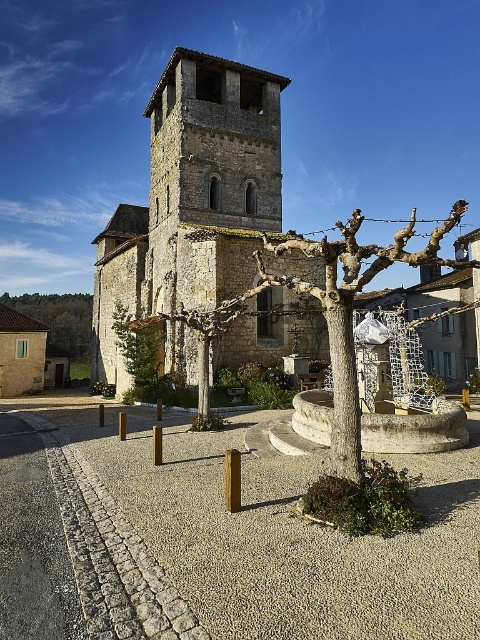
Is green leafy tree at lower left to the right of green leafy tree at center from the viewer's perspective?

Incorrect, green leafy tree at lower left is not on the right side of green leafy tree at center.

Who is more distant from viewer, (x=49, y=321) or (x=127, y=394)?

The point (x=49, y=321) is more distant.

What are the coordinates of `green leafy tree at lower left` in the screenshot? It's located at (60, 317).

Is stone tower at center shorter than green leafy tree at lower left?

No, stone tower at center is not shorter than green leafy tree at lower left.

Is stone tower at center smaller than green leafy tree at lower left?

Yes.

Image resolution: width=480 pixels, height=640 pixels. What do you see at coordinates (192, 198) in the screenshot? I see `stone tower at center` at bounding box center [192, 198].

You are a GUI agent. You are given a task and a screenshot of the screen. Output one action in this format:
    pyautogui.click(x=<x>, y=<y>)
    Task: Click on the stone tower at center
    This screenshot has height=640, width=480.
    Given the screenshot: What is the action you would take?
    pyautogui.click(x=192, y=198)

Is bare wood tree at center further to the viewer compared to green leafy tree at center?

No.

Who is taller, bare wood tree at center or green leafy tree at center?

bare wood tree at center is taller.

Image resolution: width=480 pixels, height=640 pixels. I want to click on bare wood tree at center, so click(x=351, y=308).